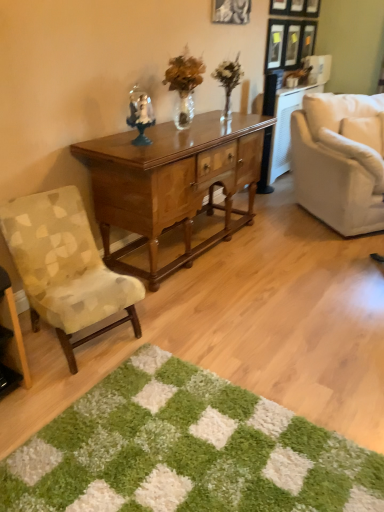
At what (x,y) coordinates should I click in order to perform the action: click on free spot above green shaggy rug at lower center (from a real-world perspective). Please return your answer as a coordinate pair (x, y). Looking at the image, I should click on (183, 448).